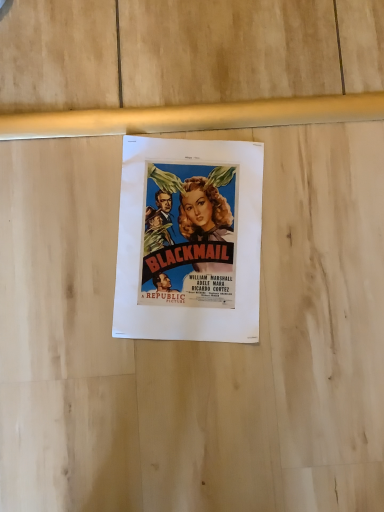
Locate an element on the screen. The image size is (384, 512). free spot above matte paper poster at center (from a real-world perspective) is located at coordinates (195, 232).